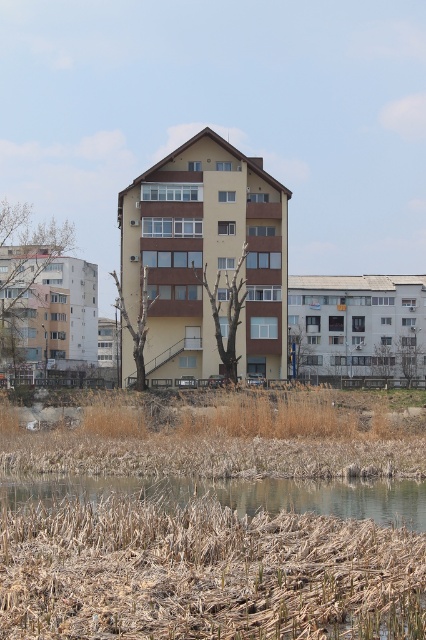
Does brown dry reed at lower left appear on the left side of brown grassy river at lower center?

Yes, brown dry reed at lower left is to the left of brown grassy river at lower center.

Between point (241, 561) and point (278, 506), which one is positioned behind?

The point (278, 506) is more distant.

What do you see at coordinates (204, 572) in the screenshot? The image size is (426, 640). I see `brown dry reed at lower left` at bounding box center [204, 572].

Locate an element on the screen. The width and height of the screenshot is (426, 640). brown dry reed at lower left is located at coordinates (204, 572).